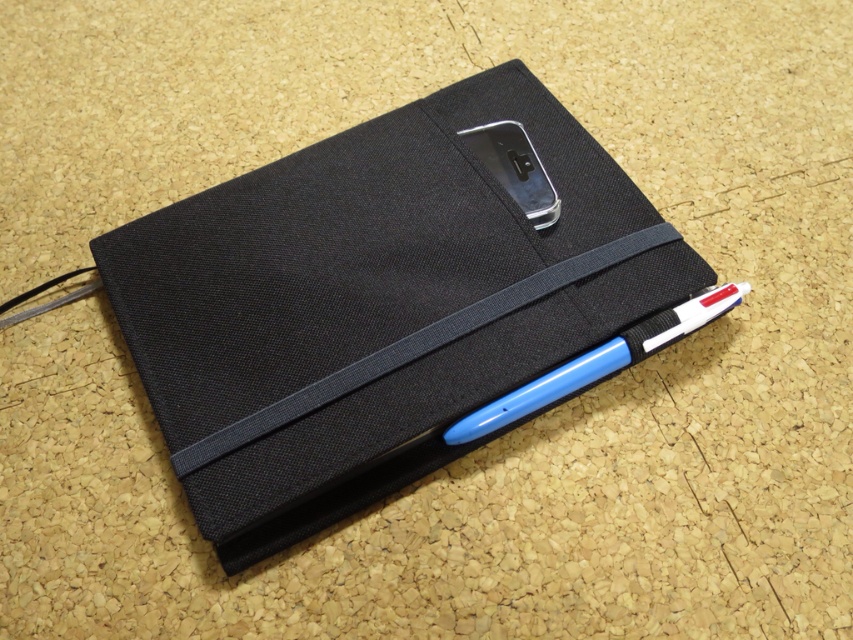
Between black fabric notebook at center and blue plastic pen at lower right, which one has more height?

black fabric notebook at center is taller.

Does black fabric notebook at center lie in front of blue plastic pen at lower right?

Yes, black fabric notebook at center is closer to the viewer.

In order to click on black fabric notebook at center in this screenshot , I will do `click(374, 304)`.